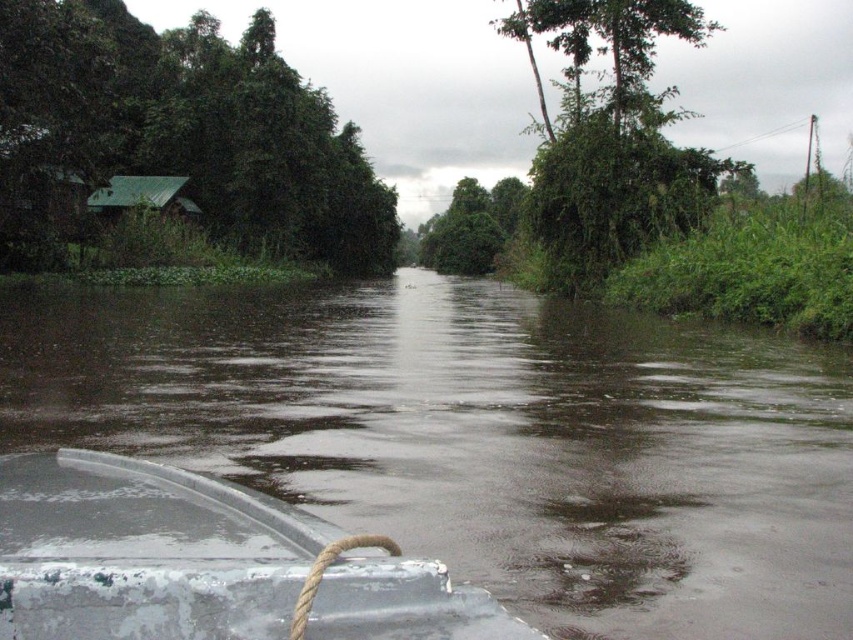
You are a hiker trying to cross the flooded area. You see the glossy dark water at center and the white matte boat at center. Which object is closer to the surface of the water?

The glossy dark water at center is located above the white matte boat at center, so the glossy dark water at center is closer to the surface of the water.

You are a delivery person needing to cross the flooded area. You see the glossy dark water at center and the white matte boat at center. Which object can you use to safely navigate the flooded area?

The white matte boat at center can be used to safely navigate the flooded area since boats are designed for water travel, whereas the glossy dark water at center is the flooded area itself and not a tool for navigation.